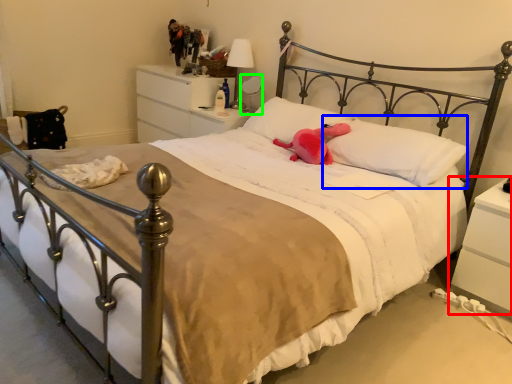
Question: Considering the real-world distances, which object is closest to nightstand (highlighted by a red box)? pillow (highlighted by a blue box) or table lamp (highlighted by a green box).

Choices:
 (A) pillow
 (B) table lamp

Answer: (A)